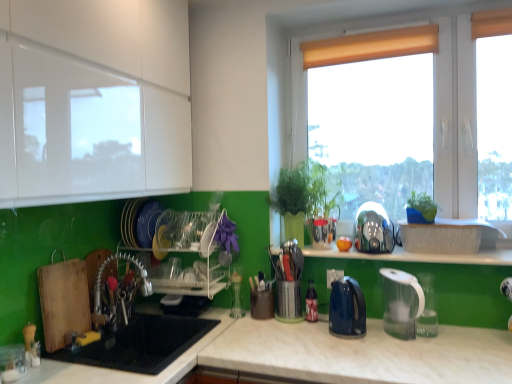
Find the location of a particular element. The image size is (512, 384). free space below green plastic plant at right, the 2th plant viewed from the back (from a real-world perspective) is located at coordinates (416, 221).